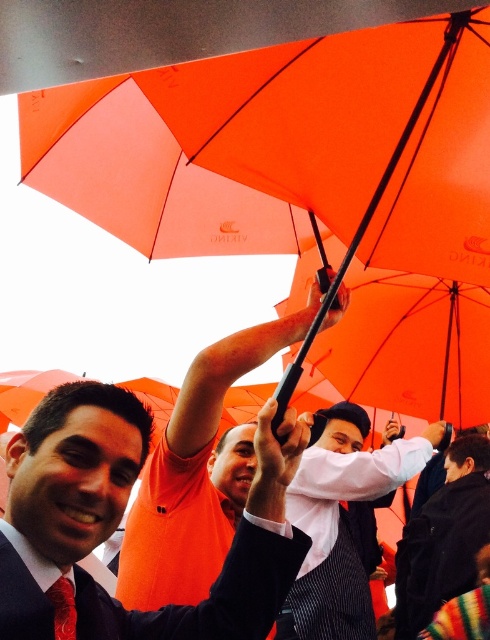
Question: Considering the relative positions of matte orange shirt at center and red satin tie at center in the image provided, where is matte orange shirt at center located with respect to red satin tie at center?

Choices:
 (A) above
 (B) below

Answer: (A)

Question: Which point is closer to the camera?

Choices:
 (A) dark blue wool coat at center
 (B) orange matte umbrella at upper center
 (C) matte orange shirt at upper center
 (D) white shirt at center

Answer: (C)

Question: Is orange matte umbrella at upper center closer to the viewer compared to red satin tie at center?

Choices:
 (A) no
 (B) yes

Answer: (A)

Question: Which object is closer to the camera taking this photo?

Choices:
 (A) orange matte umbrella at upper center
 (B) matte orange shirt at upper center

Answer: (B)

Question: Which of the following is the closest to the observer?

Choices:
 (A) (186, 589)
 (B) (73, 621)

Answer: (B)

Question: In this image, where is orange matte umbrella at upper center located relative to red satin tie at center?

Choices:
 (A) left
 (B) right

Answer: (B)